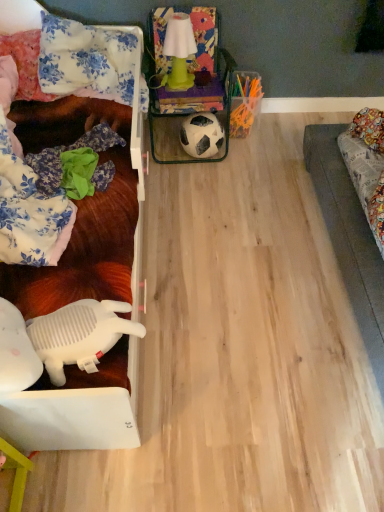
Describe the element at coordinates (26, 64) in the screenshot. The height and width of the screenshot is (512, 384). I see `floral fabric pillow at upper left, marked as the second pillow in a right-to-left arrangement` at that location.

In order to face green matte lamp at upper center, should I rotate leftwards or rightwards?

Turn left approximately 1.364 degrees to face it.

Locate an element on the screen. Image resolution: width=384 pixels, height=512 pixels. white plastic toy at lower left is located at coordinates (79, 335).

What do you see at coordinates (79, 335) in the screenshot? This screenshot has width=384, height=512. I see `white plastic toy at lower left` at bounding box center [79, 335].

Locate an element on the screen. This screenshot has height=512, width=384. floral fabric pillow at upper left, marked as the second pillow in a right-to-left arrangement is located at coordinates (26, 64).

Can you confirm if green matte lamp at upper center is bigger than floral fabric pillow at upper left, the 2th pillow from the left?

No.

Is green matte lamp at upper center taller than floral fabric pillow at upper left, acting as the first pillow starting from the right?

Indeed, green matte lamp at upper center has a greater height compared to floral fabric pillow at upper left, acting as the first pillow starting from the right.

Considering the relative positions of green matte lamp at upper center and floral fabric pillow at upper left, acting as the first pillow starting from the right, in the image provided, is green matte lamp at upper center to the left or to the right of floral fabric pillow at upper left, acting as the first pillow starting from the right,?

green matte lamp at upper center is positioned on floral fabric pillow at upper left, acting as the first pillow starting from the right,'s right side.

Which point is more distant from viewer, (164, 84) or (117, 82)?

Positioned behind is point (164, 84).

Is white matte football at center not inside green matte lamp at upper center?

Yes, white matte football at center is outside of green matte lamp at upper center.

Is white matte football at center bigger or smaller than green matte lamp at upper center?

Considering their sizes, white matte football at center takes up more space than green matte lamp at upper center.

From the image's perspective, relative to green matte lamp at upper center, is white matte football at center above or below?

Based on their image positions, white matte football at center is located beneath green matte lamp at upper center.

From a real-world perspective, is white matte football at center physically located above or below green matte lamp at upper center?

white matte football at center is below green matte lamp at upper center.

Is white plastic toy at left next to white plastic toy at lower left and touching it?

No, white plastic toy at left is not with white plastic toy at lower left.

Which object is positioned more to the left, white plastic toy at left or white plastic toy at lower left?

white plastic toy at left is more to the left.

Is white plastic toy at left positioned in front of white plastic toy at lower left?

Yes, the depth of white plastic toy at left is less than that of white plastic toy at lower left.

Consider the image. From the image's perspective, who appears lower, white plastic toy at left or white plastic toy at lower left?

From the image's view, white plastic toy at lower left is below.

Does point (124, 33) come behind point (197, 156)?

No, it is in front of (197, 156).

Does floral fabric pillow at upper left, acting as the first pillow starting from the right, have a greater width compared to white matte football at center?

Indeed, floral fabric pillow at upper left, acting as the first pillow starting from the right, has a greater width compared to white matte football at center.

From a real-world perspective, between floral fabric pillow at upper left, acting as the first pillow starting from the right, and white matte football at center, who is vertically higher?

floral fabric pillow at upper left, acting as the first pillow starting from the right.

From a real-world perspective, relative to white plastic toy at lower left, is floral fabric pillow at upper left, marked as the second pillow in a right-to-left arrangement, vertically above or below?

floral fabric pillow at upper left, marked as the second pillow in a right-to-left arrangement, is above white plastic toy at lower left.

Does floral fabric pillow at upper left, positioned as the first pillow in left-to-right order, have a lesser width compared to white plastic toy at lower left?

Incorrect, the width of floral fabric pillow at upper left, positioned as the first pillow in left-to-right order, is not less than that of white plastic toy at lower left.

From the image's perspective, does floral fabric pillow at upper left, marked as the second pillow in a right-to-left arrangement, appear higher than white plastic toy at lower left?

Yes, from the image's perspective, floral fabric pillow at upper left, marked as the second pillow in a right-to-left arrangement, is above white plastic toy at lower left.

Between floral fabric pillow at upper left, marked as the second pillow in a right-to-left arrangement, and white plastic toy at lower left, which one has smaller size?

With smaller size is white plastic toy at lower left.

Which of these two, green matte lamp at upper center or floral fabric pillow at upper left, marked as the second pillow in a right-to-left arrangement, stands shorter?

Standing shorter between the two is floral fabric pillow at upper left, marked as the second pillow in a right-to-left arrangement.

Do you think green matte lamp at upper center is within floral fabric pillow at upper left, positioned as the first pillow in left-to-right order, or outside of it?

green matte lamp at upper center exists outside the volume of floral fabric pillow at upper left, positioned as the first pillow in left-to-right order.

Does green matte lamp at upper center have a lesser width compared to floral fabric pillow at upper left, marked as the second pillow in a right-to-left arrangement?

Yes, green matte lamp at upper center is thinner than floral fabric pillow at upper left, marked as the second pillow in a right-to-left arrangement.

The width and height of the screenshot is (384, 512). Identify the location of lamp that appears above the floral fabric pillow at upper left, positioned as the first pillow in left-to-right order (from the image's perspective). (179, 52).

Is white matte football at center positioned with its back to white plastic toy at lower left?

No, white plastic toy at lower left is not at the back of white matte football at center.

Considering the points (193, 140) and (90, 305), which point is in front, point (193, 140) or point (90, 305)?

Positioned in front is point (90, 305).

Are white matte football at center and white plastic toy at lower left making contact?

No, white matte football at center is not with white plastic toy at lower left.

From the green matte lamp at upper center, count the 1st pillow to the left and point to it. Please provide its 2D coordinates.

[(86, 60)]

Image resolution: width=384 pixels, height=512 pixels. Find the location of `football beneath the green matte lamp at upper center (from a real-world perspective)`. football beneath the green matte lamp at upper center (from a real-world perspective) is located at coordinates (201, 135).

Consider the image. When comparing their distances from white plastic toy at left, does white matte football at center or floral fabric pillow at upper left, acting as the first pillow starting from the right, seem closer?

Among the two, floral fabric pillow at upper left, acting as the first pillow starting from the right, is located nearer to white plastic toy at left.

Based on their spatial positions, is white matte football at center or green matte lamp at upper center further from floral fabric pillow at upper left, marked as the second pillow in a right-to-left arrangement?

white matte football at center is further to floral fabric pillow at upper left, marked as the second pillow in a right-to-left arrangement.

From the image, which object appears to be nearer to white matte football at center, floral fabric pillow at upper left, positioned as the first pillow in left-to-right order, or green matte lamp at upper center?

Among the two, green matte lamp at upper center is located nearer to white matte football at center.

When comparing their distances from white plastic toy at lower left, does white plastic toy at left or floral fabric pillow at upper left, the 2th pillow from the left, seem further?

Based on the image, floral fabric pillow at upper left, the 2th pillow from the left, appears to be further to white plastic toy at lower left.

Based on their spatial positions, is white plastic toy at lower left or green matte lamp at upper center closer to white plastic toy at left?

white plastic toy at lower left lies closer to white plastic toy at left than the other object.

Estimate the real-world distances between objects in this image. Which object is further from white matte football at center, white plastic toy at left or floral fabric pillow at upper left, the 2th pillow from the left?

white plastic toy at left is further to white matte football at center.

Which object lies nearer to the anchor point white matte football at center, green matte lamp at upper center or floral fabric pillow at upper left, positioned as the first pillow in left-to-right order?

The object closer to white matte football at center is green matte lamp at upper center.

Based on their spatial positions, is floral fabric pillow at upper left, positioned as the first pillow in left-to-right order, or green matte lamp at upper center further from white plastic toy at lower left?

Based on the image, green matte lamp at upper center appears to be further to white plastic toy at lower left.

Locate an element on the screen. The width and height of the screenshot is (384, 512). furniture between floral fabric pillow at upper left, acting as the first pillow starting from the right, and white plastic toy at lower left, in the vertical direction is located at coordinates (74, 416).

Image resolution: width=384 pixels, height=512 pixels. I want to click on football that lies between green matte lamp at upper center and white plastic toy at lower left from top to bottom, so click(x=201, y=135).

Locate an element on the screen. This screenshot has width=384, height=512. football between floral fabric pillow at upper left, positioned as the first pillow in left-to-right order, and white plastic toy at lower left, in the vertical direction is located at coordinates (201, 135).

Locate an element on the screen. pillow between floral fabric pillow at upper left, marked as the second pillow in a right-to-left arrangement, and green matte lamp at upper center is located at coordinates (86, 60).